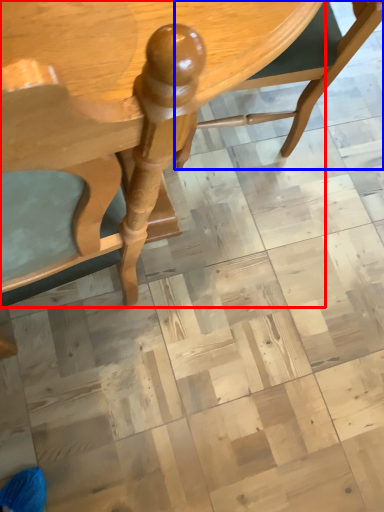
Question: Which of the following is the farthest to the observer, table (highlighted by a red box) or chair (highlighted by a blue box)?

Choices:
 (A) table
 (B) chair

Answer: (B)